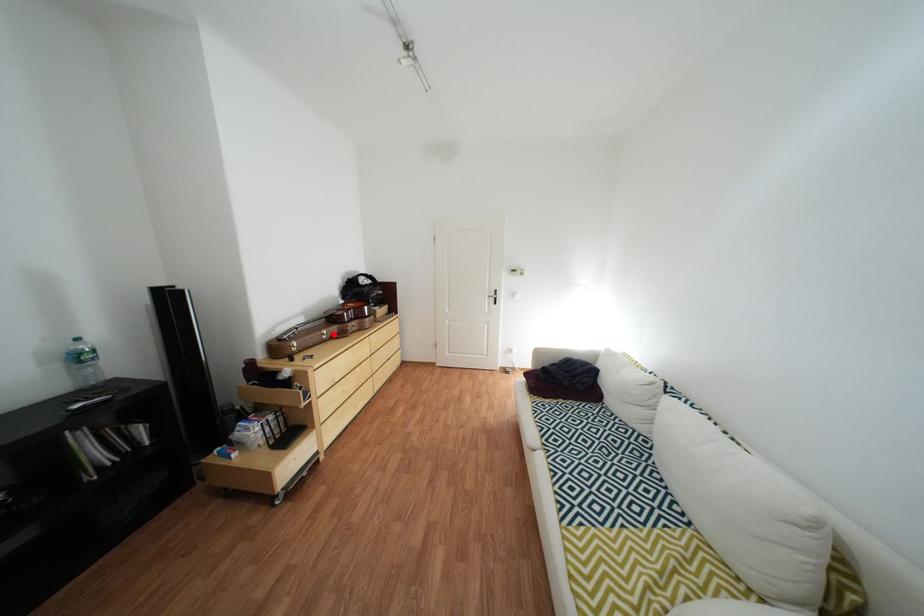
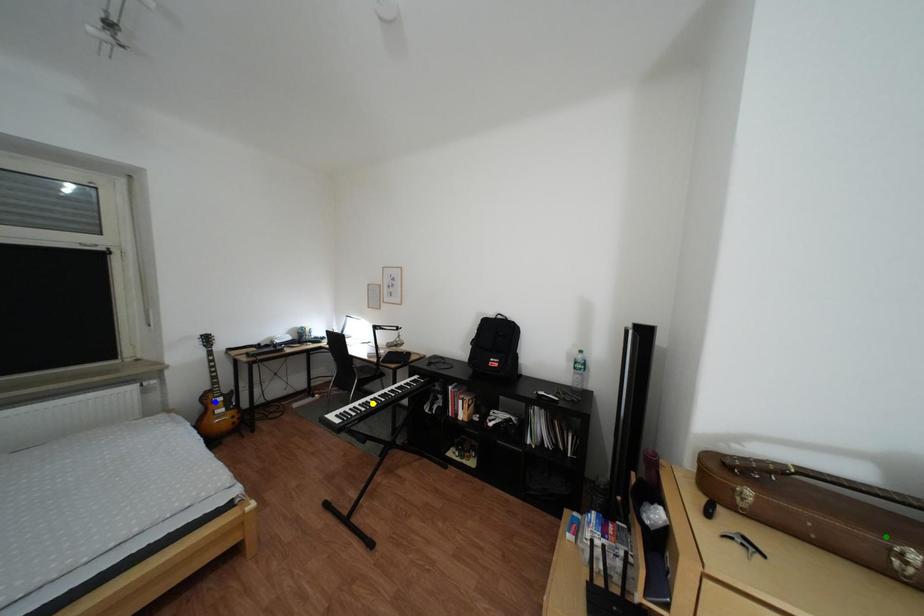
Question: I am providing you with two images of the same scene from different viewpoints. A red point is marked on the first image. You are given multiple points on the second image. Which point in image 2 represents the same 3d spot as the red point in image 1?

Choices:
 (A) blue point
 (B) yellow point
 (C) green point

Answer: (C)